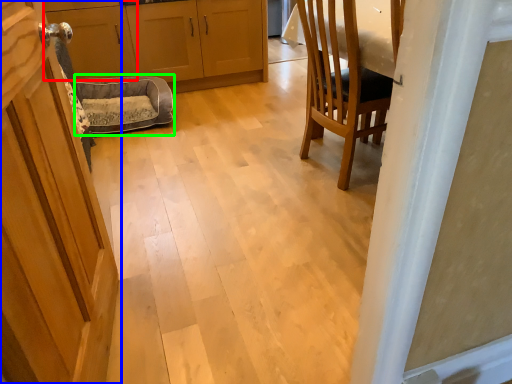
Question: Which object is positioned farthest from cabinetry (highlighted by a red box)? Select from door (highlighted by a blue box) and dog bed (highlighted by a green box).

Choices:
 (A) door
 (B) dog bed

Answer: (A)